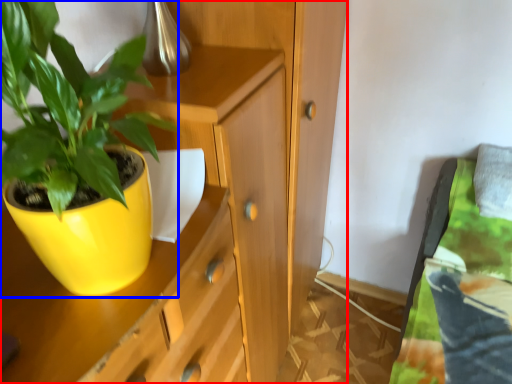
Question: Which object appears farthest to the camera in this image, cabinetry (highlighted by a red box) or houseplant (highlighted by a blue box)?

Choices:
 (A) cabinetry
 (B) houseplant

Answer: (A)